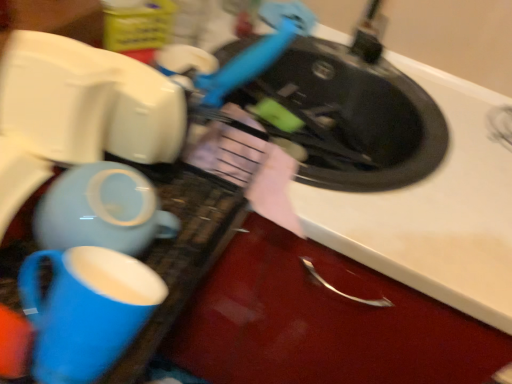
Question: Do you think white matte sink at upper right is within matte ceramic mug at lower left, or outside of it?

Choices:
 (A) inside
 (B) outside

Answer: (B)

Question: From the image's perspective, is white matte sink at upper right positioned above or below matte ceramic mug at lower left?

Choices:
 (A) below
 (B) above

Answer: (B)

Question: Based on their relative distances, which object is nearer to the white matte sink at upper right?

Choices:
 (A) matte ceramic teapot at lower left
 (B) matte ceramic mug at lower left

Answer: (A)

Question: Estimate the real-world distances between objects in this image. Which object is closer to the matte ceramic teapot at lower left?

Choices:
 (A) white matte sink at upper right
 (B) matte ceramic mug at lower left

Answer: (B)